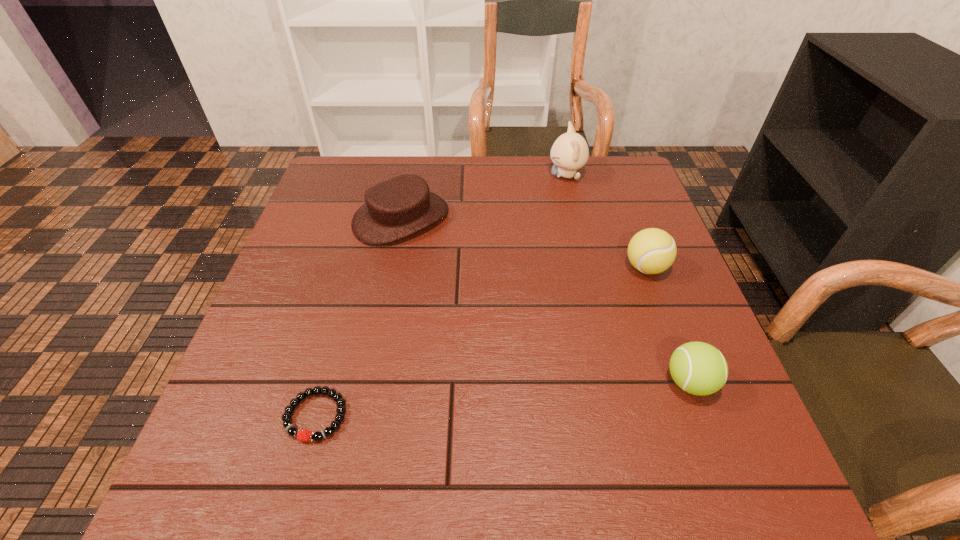
The height and width of the screenshot is (540, 960). Find the location of `vacant area between the third object from left to right and the third farthest object`. vacant area between the third object from left to right and the third farthest object is located at coordinates point(606,221).

Find the location of a particular element. empty space that is in between the farther tennis ball and the hat is located at coordinates (523, 243).

In order to click on empty location between the second farthest object and the nearer tennis ball in this screenshot , I will do `click(545, 300)`.

You are a GUI agent. You are given a task and a screenshot of the screen. Output one action in this format:
    pyautogui.click(x=<x>, y=<y>)
    Task: Click on the empty location between the third farthest object and the tallest object
    The height and width of the screenshot is (540, 960).
    Given the screenshot: What is the action you would take?
    tap(606, 221)

Where is `free space between the kitten and the nearer tennis ball`? Image resolution: width=960 pixels, height=540 pixels. free space between the kitten and the nearer tennis ball is located at coordinates (628, 279).

Identify the location of free space between the nearer tennis ball and the farther tennis ball. (667, 325).

Identify which object is located as the nearest to the bracelet. Please provide its 2D coordinates. Your answer should be formatted as a tuple, i.e. [(x, y)], where the tuple contains the x and y coordinates of a point satisfying the conditions above.

[(403, 205)]

Locate which object ranks fourth in proximity to the hat. Please provide its 2D coordinates. Your answer should be formatted as a tuple, i.e. [(x, y)], where the tuple contains the x and y coordinates of a point satisfying the conditions above.

[(698, 368)]

At what (x,y) coordinates should I click in order to perform the action: click on vacant space that satisfies the following two spatial constraints: 1. on the face of the nearer tennis ball; 2. on the left side of the third object from right to left. Please return your answer as a coordinate pair (x, y). The width and height of the screenshot is (960, 540). Looking at the image, I should click on (616, 382).

The height and width of the screenshot is (540, 960). Identify the location of vacant area in the image that satisfies the following two spatial constraints: 1. on the face of the farthest object; 2. on the front side of the hat. (577, 218).